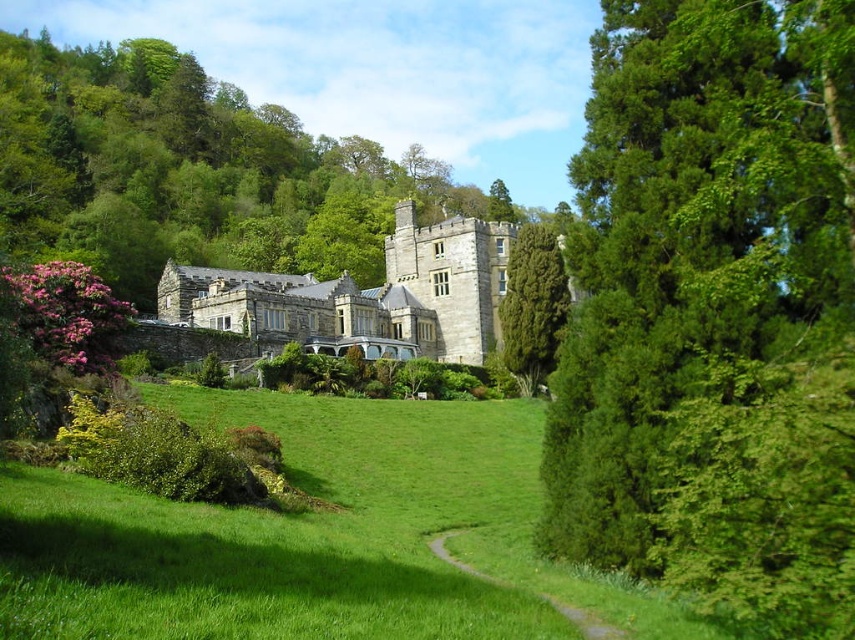
Can you confirm if green leafy tree at center is positioned to the left of green textured tree at center right?

Yes, green leafy tree at center is to the left of green textured tree at center right.

Which is below, green leafy tree at center or green textured tree at center right?

green textured tree at center right

Where is `green leafy tree at center`? The width and height of the screenshot is (855, 640). green leafy tree at center is located at coordinates (192, 172).

At what (x,y) coordinates should I click in order to perform the action: click on green leafy tree at center. Please return your answer as a coordinate pair (x, y). The height and width of the screenshot is (640, 855). Looking at the image, I should click on (192, 172).

Based on the photo, between pink matte rhododendron at lower left and green textured tree at center right, which one has less height?

pink matte rhododendron at lower left

You are a GUI agent. You are given a task and a screenshot of the screen. Output one action in this format:
    pyautogui.click(x=<x>, y=<y>)
    Task: Click on the pink matte rhododendron at lower left
    The width and height of the screenshot is (855, 640).
    Given the screenshot: What is the action you would take?
    pyautogui.click(x=68, y=314)

Measure the distance between green leafy tree at center and stone mansion at center.

green leafy tree at center is 39.97 meters away from stone mansion at center.

Between point (445, 170) and point (213, 314), which one is positioned behind?

The point (445, 170) is more distant.

Locate an element on the screen. The height and width of the screenshot is (640, 855). green leafy tree at center is located at coordinates tap(192, 172).